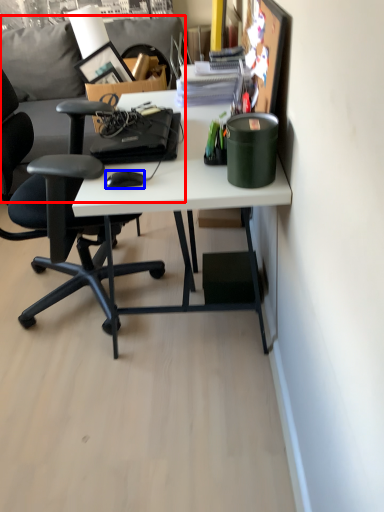
Question: Which object appears closest to the camera in this image, couch (highlighted by a red box) or mouse (highlighted by a blue box)?

Choices:
 (A) couch
 (B) mouse

Answer: (B)